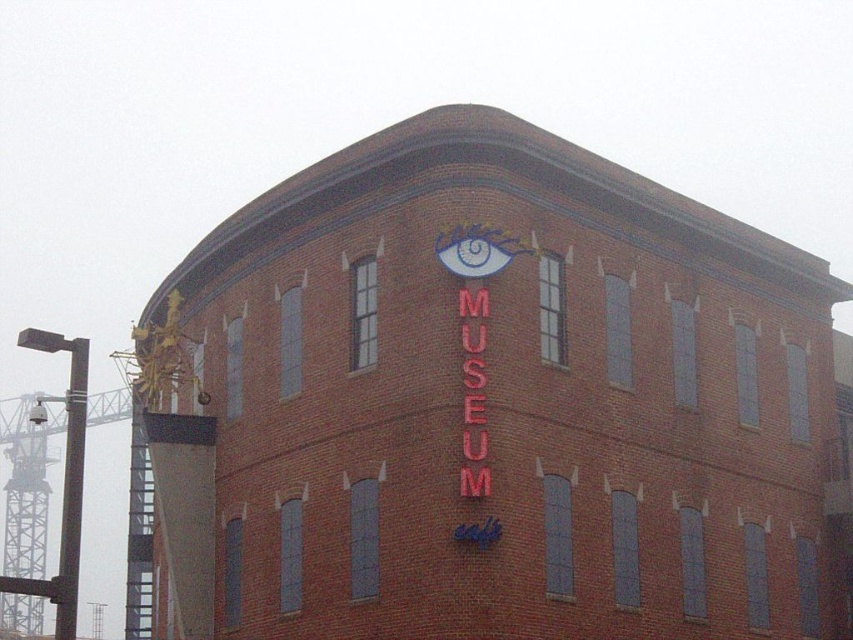
Between red neon sign at upper center and red neon sign at center, which one appears on the right side from the viewer's perspective?

Positioned to the right is red neon sign at center.

From the picture: Does red neon sign at upper center have a smaller size compared to red neon sign at center?

No, red neon sign at upper center is not smaller than red neon sign at center.

This screenshot has width=853, height=640. In order to click on red neon sign at upper center in this screenshot , I will do `click(511, 401)`.

Locate an element on the screen. This screenshot has height=640, width=853. red neon sign at upper center is located at coordinates (511, 401).